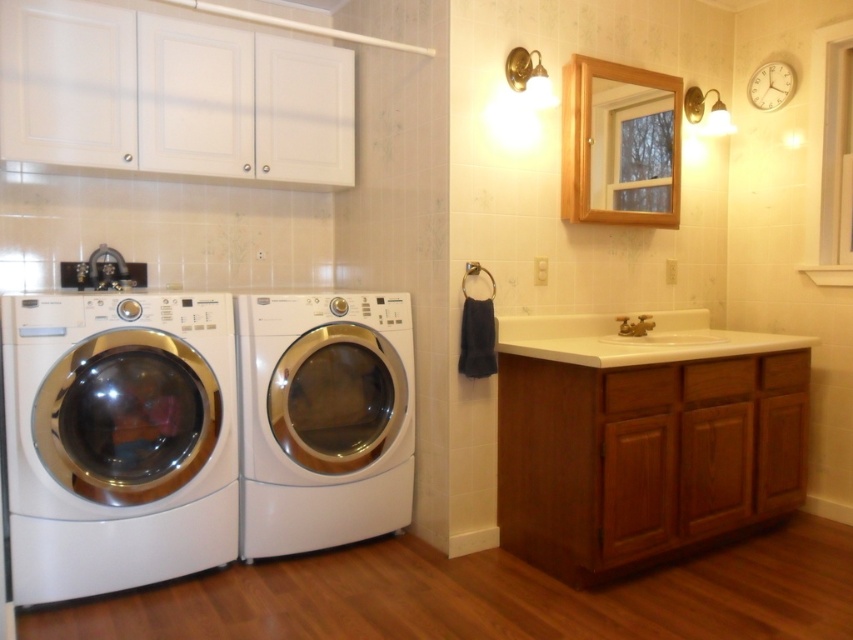
Question: Can you confirm if white glossy washing machine at lower left is wider than white glossy washing machine at center?

Choices:
 (A) no
 (B) yes

Answer: (A)

Question: Which object is positioned closest to the white glossy washing machine at center?

Choices:
 (A) white glossy washing machine at lower left
 (B) white glossy sink at center

Answer: (A)

Question: Which object is the farthest from the white glossy washing machine at lower left?

Choices:
 (A) white glossy sink at center
 (B) white glossy washing machine at center

Answer: (A)

Question: Which point appears closest to the camera in this image?

Choices:
 (A) (624, 316)
 (B) (282, 355)

Answer: (B)

Question: Does white glossy washing machine at lower left appear on the left side of white glossy sink at center?

Choices:
 (A) yes
 (B) no

Answer: (A)

Question: Does white glossy washing machine at lower left appear over white glossy sink at center?

Choices:
 (A) no
 (B) yes

Answer: (A)